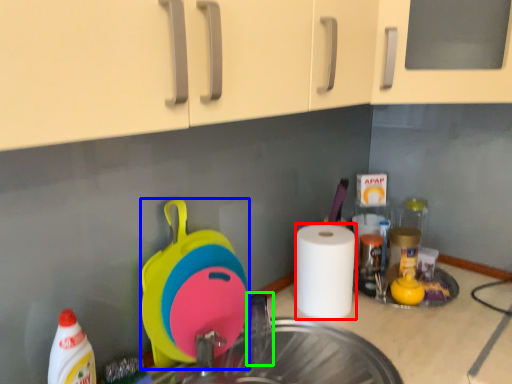
Question: Which object is the farthest from paper towel (highlighted by a red box)? Choose among these: appliance (highlighted by a blue box) or faucet (highlighted by a green box).

Choices:
 (A) appliance
 (B) faucet

Answer: (A)